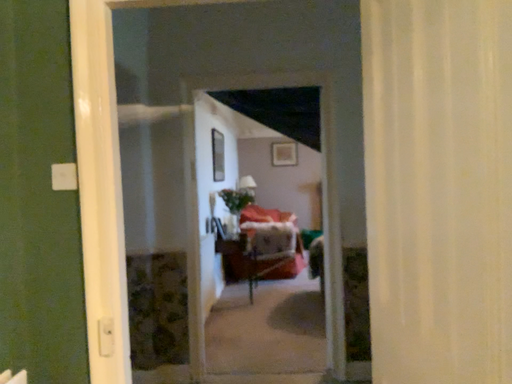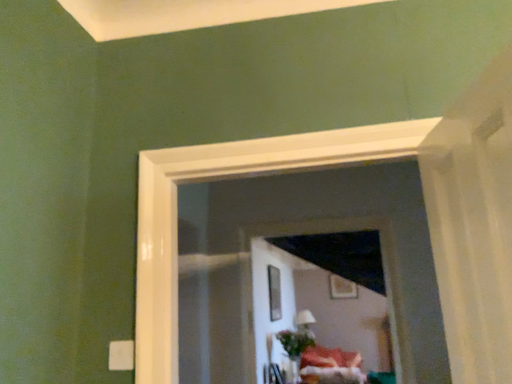
Question: Which way did the camera rotate in the video?

Choices:
 (A) rotated upward
 (B) rotated downward

Answer: (A)